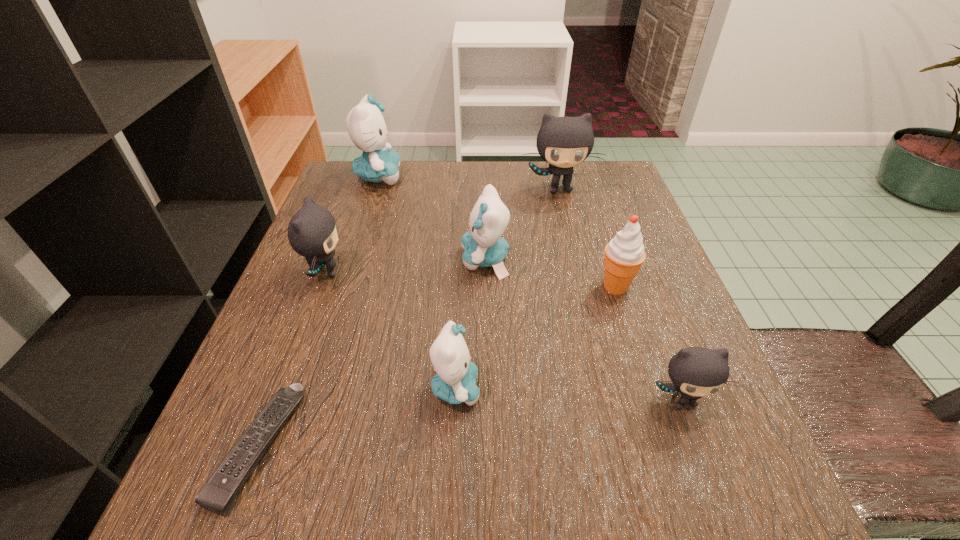
Locate an element on the screen. blank space that satisfies the following two spatial constraints: 1. on the front-facing side of the second smallest gray kitten; 2. on the right side of the red icecream is located at coordinates (321, 287).

Where is `free spot that satisfies the following two spatial constraints: 1. on the front-facing side of the farthest gray kitten; 2. on the front-facing side of the leftmost gray kitten`? This screenshot has width=960, height=540. free spot that satisfies the following two spatial constraints: 1. on the front-facing side of the farthest gray kitten; 2. on the front-facing side of the leftmost gray kitten is located at coordinates (579, 272).

Locate an element on the screen. free space that satisfies the following two spatial constraints: 1. on the front-facing side of the farthest gray kitten; 2. on the face of the second smallest blue kitten is located at coordinates (576, 260).

Where is `free region that satisfies the following two spatial constraints: 1. on the front-facing side of the biggest gray kitten; 2. on the left side of the red icecream`? The height and width of the screenshot is (540, 960). free region that satisfies the following two spatial constraints: 1. on the front-facing side of the biggest gray kitten; 2. on the left side of the red icecream is located at coordinates (583, 287).

You are a GUI agent. You are given a task and a screenshot of the screen. Output one action in this format:
    pyautogui.click(x=<x>, y=<y>)
    Task: Click on the free space that satisfies the following two spatial constraints: 1. on the face of the red icecream; 2. on the right side of the farthest blue kitten
    
    Given the screenshot: What is the action you would take?
    pyautogui.click(x=343, y=287)